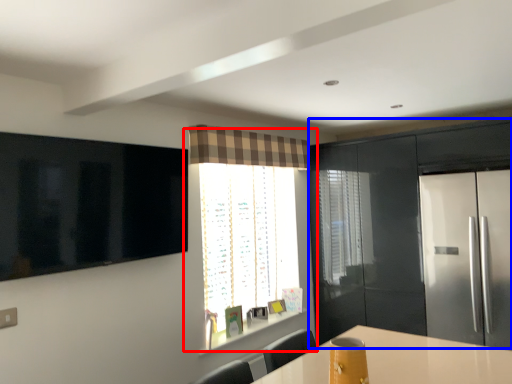
Question: Which object appears closest to the camera in this image, window (highlighted by a red box) or cabinetry (highlighted by a blue box)?

Choices:
 (A) window
 (B) cabinetry

Answer: (B)